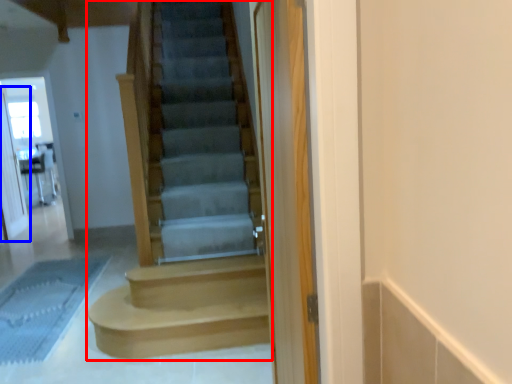
Question: Which object is closer to the camera taking this photo, stairs (highlighted by a red box) or screen door (highlighted by a blue box)?

Choices:
 (A) stairs
 (B) screen door

Answer: (A)